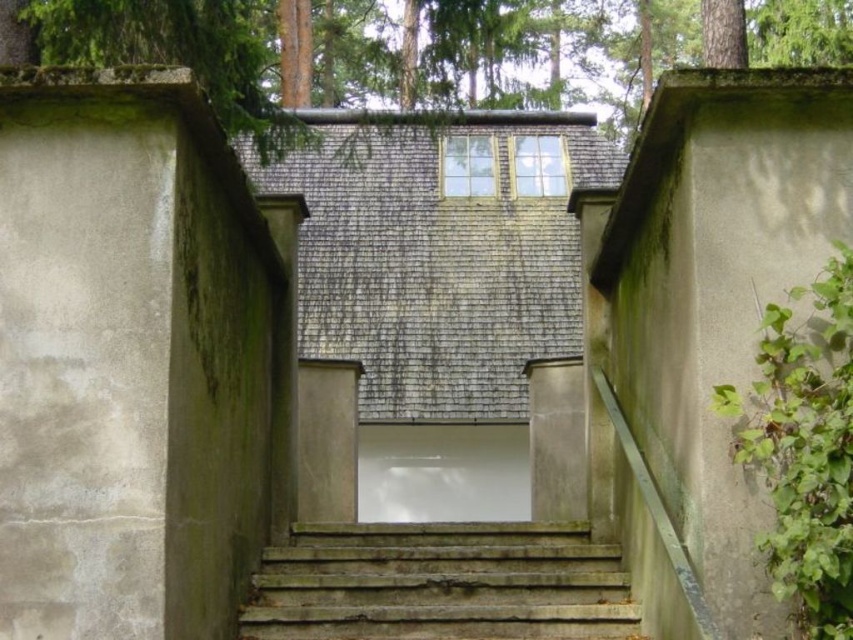
Question: Is the position of green textured tree at upper center more distant than that of rusty concrete stairs at center?

Choices:
 (A) yes
 (B) no

Answer: (B)

Question: Is green textured tree at upper center bigger than rusty concrete stairs at center?

Choices:
 (A) no
 (B) yes

Answer: (B)

Question: Which of the following is the closest to the observer?

Choices:
 (A) rusty concrete stairs at center
 (B) green textured tree at upper center

Answer: (B)

Question: Does green textured tree at upper center have a larger size compared to rusty concrete stairs at center?

Choices:
 (A) yes
 (B) no

Answer: (A)